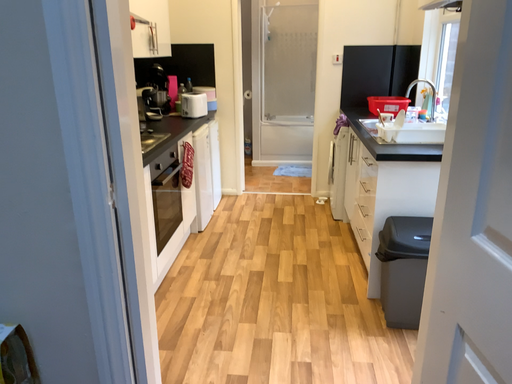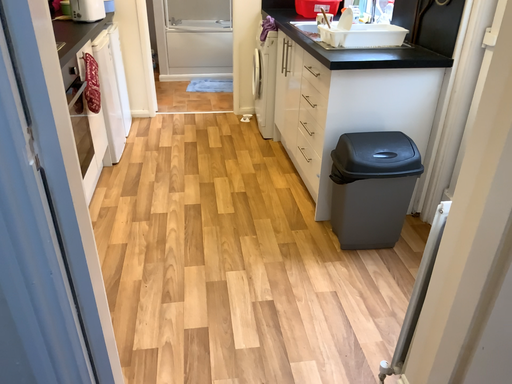
Question: How did the camera likely rotate when shooting the video?

Choices:
 (A) rotated downward
 (B) rotated upward

Answer: (A)